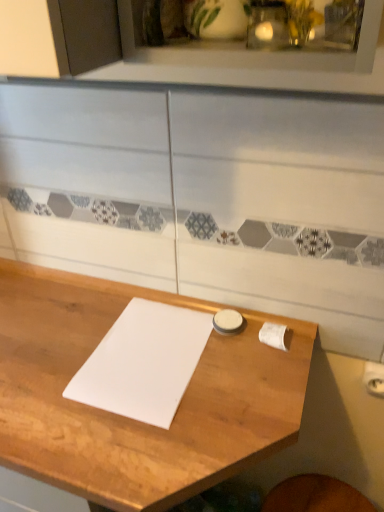
Where is `vacant region under white matte journal at center (from a real-world perspective)`? vacant region under white matte journal at center (from a real-world perspective) is located at coordinates (148, 357).